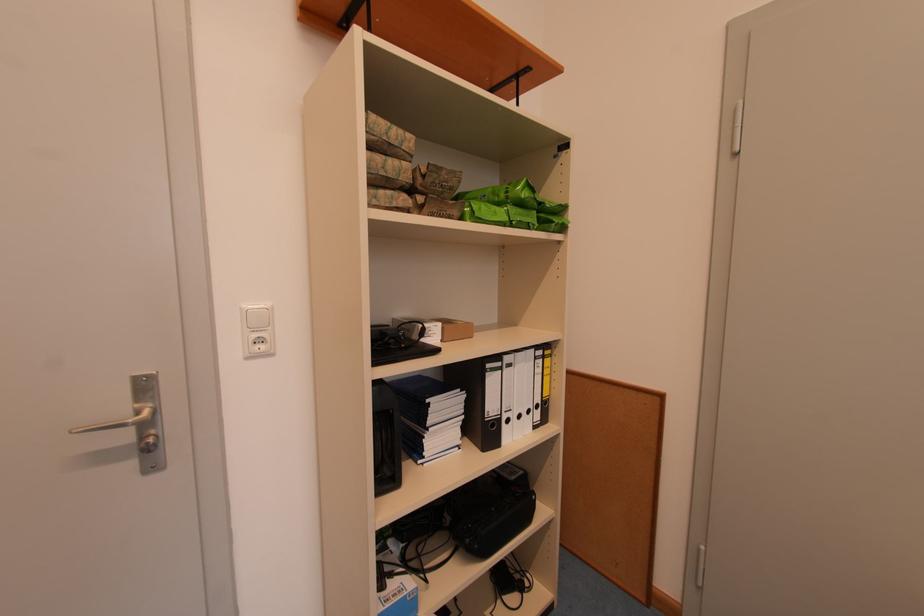
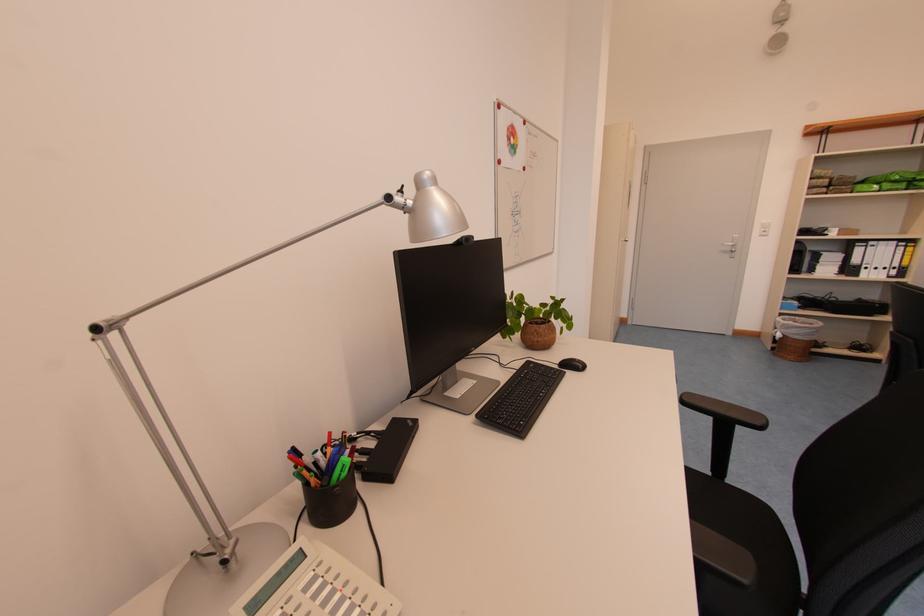
Find the pixel in the second image that matches (x=495, y=368) in the first image.

(865, 246)